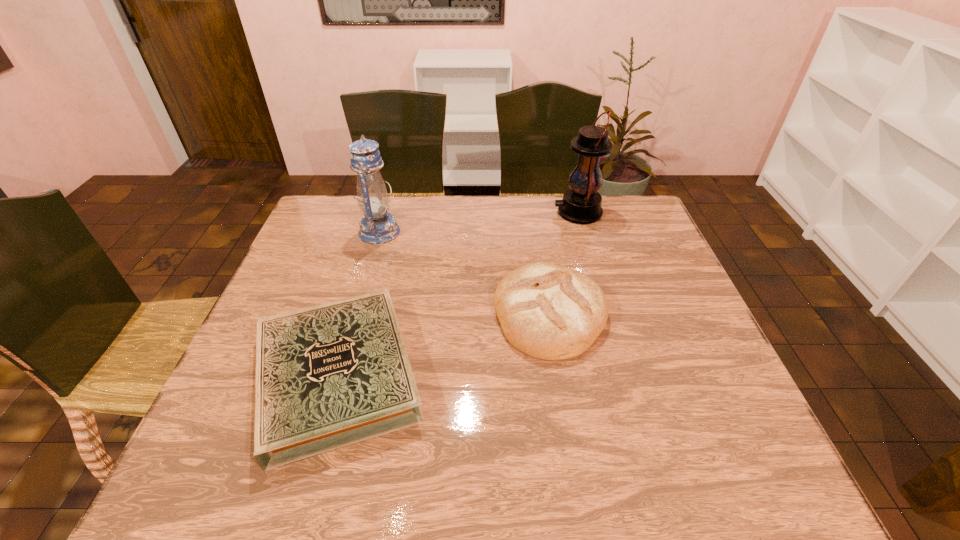
At what (x,y) coordinates should I click in order to perform the action: click on object that is at the near edge. Please return your answer as a coordinate pair (x, y). This screenshot has height=540, width=960. Looking at the image, I should click on (331, 375).

Where is `object that is at the left edge`? object that is at the left edge is located at coordinates (331, 375).

The image size is (960, 540). Identify the location of object positioned at the right edge. (581, 204).

At what (x,y) coordinates should I click in order to perform the action: click on object that is at the near left corner. Please return your answer as a coordinate pair (x, y). The image size is (960, 540). Looking at the image, I should click on point(331,375).

The width and height of the screenshot is (960, 540). In order to click on object at the far right corner in this screenshot , I will do `click(581, 204)`.

Where is `vacant space at the far edge of the desktop`? This screenshot has width=960, height=540. vacant space at the far edge of the desktop is located at coordinates (434, 228).

Identify the location of vacant space at the near edge of the desktop. The image size is (960, 540). (582, 488).

Identify the location of vacant area at the right edge. Image resolution: width=960 pixels, height=540 pixels. (696, 402).

This screenshot has height=540, width=960. What are the coordinates of `vacant space at the far left corner of the desktop` in the screenshot? It's located at (325, 201).

At what (x,y) coordinates should I click in order to perform the action: click on vacant space at the near left corner. Please return your answer as a coordinate pair (x, y). Looking at the image, I should click on (252, 451).